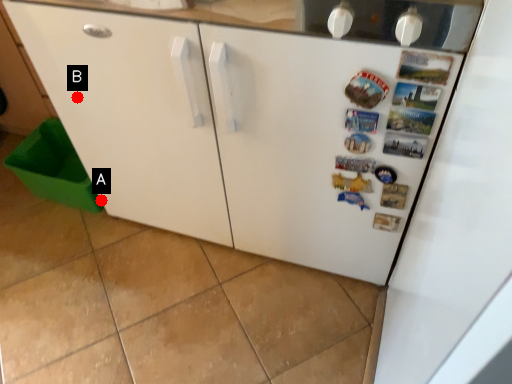
Question: Two points are circled on the image, labeled by A and B beside each circle. Which of the following is the closest to the observer?

Choices:
 (A) A is closer
 (B) B is closer

Answer: (B)